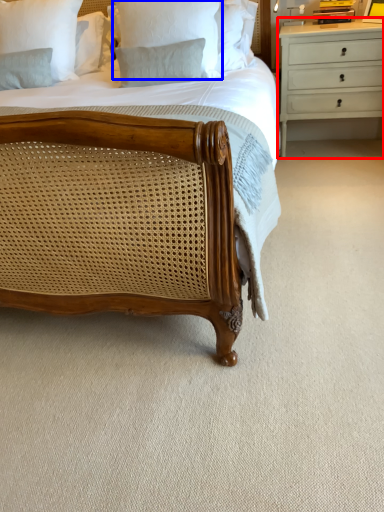
Question: Which point is closer to the camera, chest of drawers (highlighted by a red box) or pillow (highlighted by a blue box)?

Choices:
 (A) chest of drawers
 (B) pillow

Answer: (B)